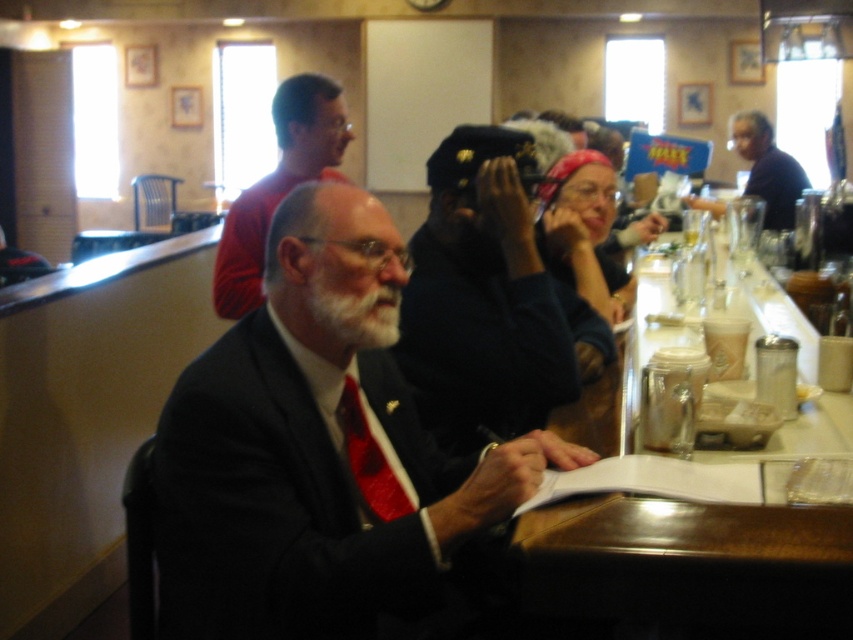
Question: Is metallic silver tray at center to the right of matte red shirt at upper left from the viewer's perspective?

Choices:
 (A) no
 (B) yes

Answer: (B)

Question: Among these objects, which one is farthest from the camera?

Choices:
 (A) dark blue uniform at center
 (B) white matte beard at center
 (C) metallic silver tray at center
 (D) dark blue shirt at right

Answer: (D)

Question: Which of the following is the closest to the observer?

Choices:
 (A) (276, 202)
 (B) (306, 515)
 (C) (451, 209)

Answer: (B)

Question: Considering the relative positions of white matte beard at center and dark blue shirt at right in the image provided, where is white matte beard at center located with respect to dark blue shirt at right?

Choices:
 (A) below
 (B) above

Answer: (A)

Question: Which point appears farthest from the camera in this image?

Choices:
 (A) (741, 147)
 (B) (695, 572)
 (C) (490, 236)
 (D) (358, 324)

Answer: (A)

Question: Can you confirm if metallic silver tray at center is smaller than matte red shirt at upper left?

Choices:
 (A) no
 (B) yes

Answer: (A)